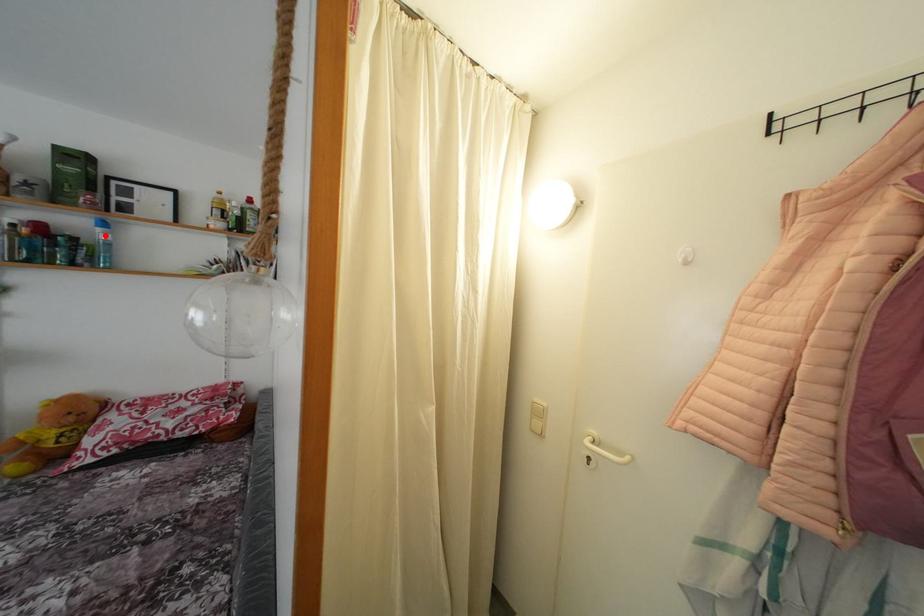
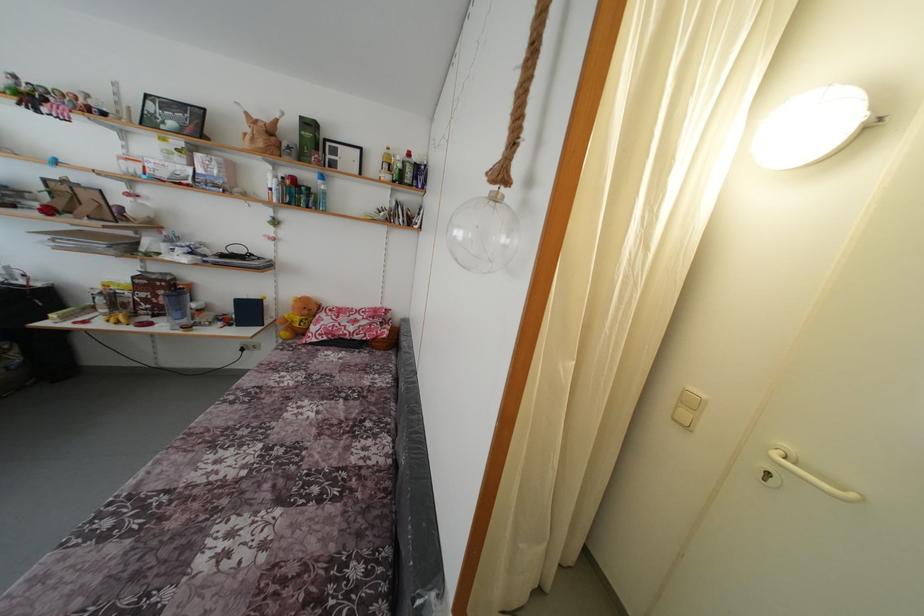
Where in the second image is the point corresponding to the highlighted location from the first image?

(324, 188)